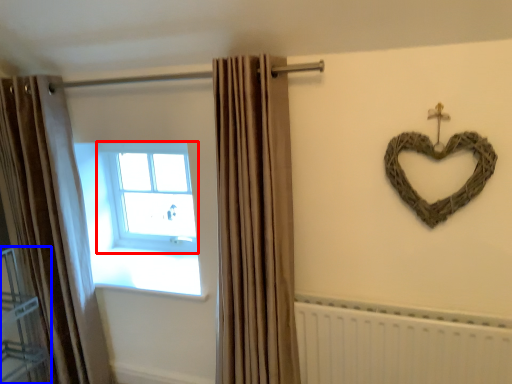
Question: Which object appears closest to the camera in this image, window (highlighted by a red box) or shelf (highlighted by a blue box)?

Choices:
 (A) window
 (B) shelf

Answer: (B)